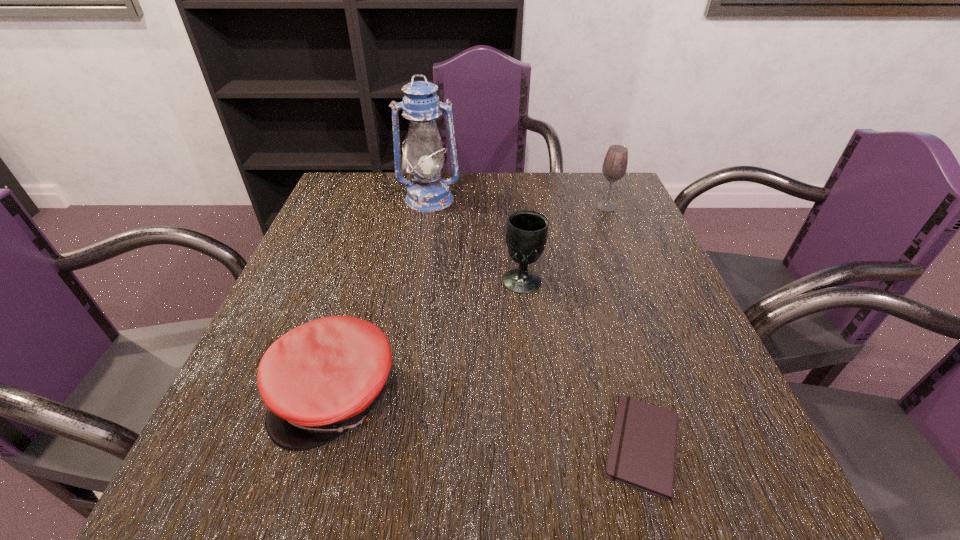
The height and width of the screenshot is (540, 960). I want to click on vacant space that satisfies the following two spatial constraints: 1. on the front-facing side of the lantern; 2. on the left side of the checkbook, so click(389, 446).

Find the location of a particular element. vacant space that satisfies the following two spatial constraints: 1. at the front of the checkbook where the visor is located; 2. on the right side of the cap is located at coordinates (322, 446).

Identify the location of free location that satisfies the following two spatial constraints: 1. on the front-facing side of the lantern; 2. on the left side of the glass drink container. [428, 207].